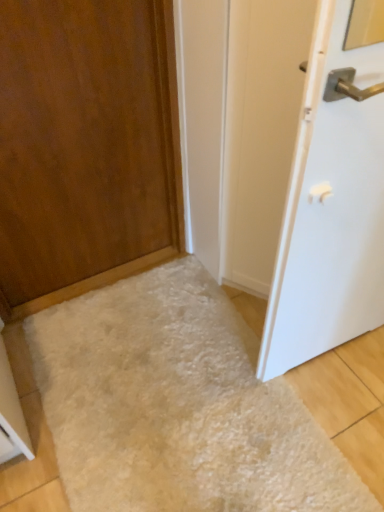
Image resolution: width=384 pixels, height=512 pixels. I want to click on empty space that is ontop of white fluffy rug at lower center (from a real-world perspective), so click(178, 394).